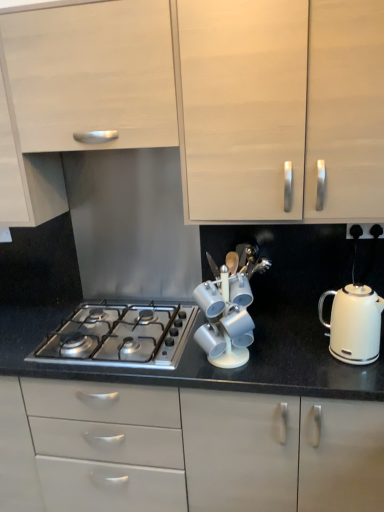
Find the location of a particular element. vacant space in between white glossy cup at center and white glossy kettle at right is located at coordinates (289, 356).